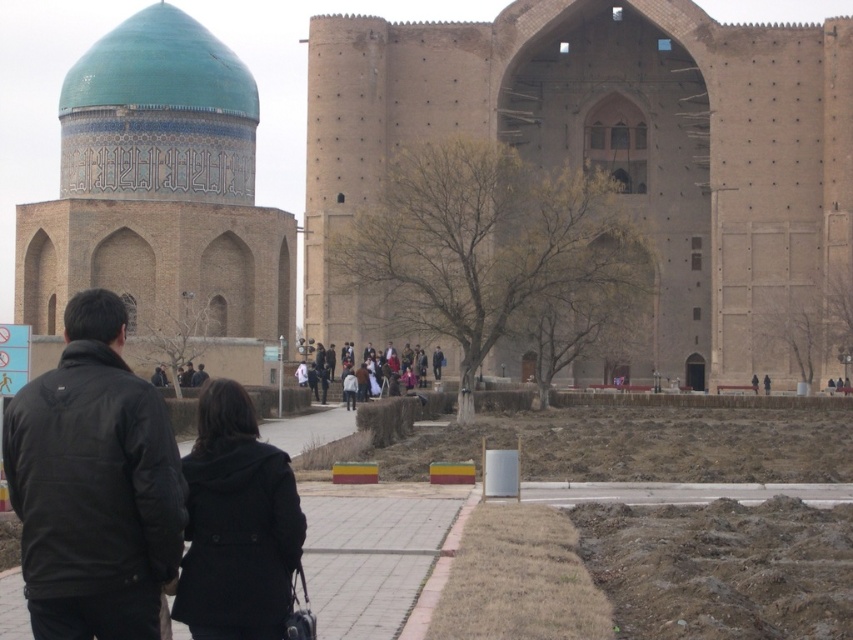
Measure the distance between black softshell jacket at lower left and black wool coat at center.

black softshell jacket at lower left and black wool coat at center are 3.21 meters apart from each other.

You are a GUI agent. You are given a task and a screenshot of the screen. Output one action in this format:
    pyautogui.click(x=<x>, y=<y>)
    Task: Click on the black softshell jacket at lower left
    This screenshot has height=640, width=853.
    Given the screenshot: What is the action you would take?
    pyautogui.click(x=94, y=484)

Does black wool coat at center have a larger size compared to black matte jacket at center?

Yes, black wool coat at center is bigger than black matte jacket at center.

Image resolution: width=853 pixels, height=640 pixels. In order to click on black wool coat at center in this screenshot , I will do `click(236, 524)`.

Does point (286, 456) come in front of point (202, 372)?

Yes.

At what (x,y) coordinates should I click in order to perform the action: click on black wool coat at center. Please return your answer as a coordinate pair (x, y). This screenshot has height=640, width=853. Looking at the image, I should click on (236, 524).

Is black softshell jacket at lower left further to the viewer compared to black matte jacket at center?

No, black softshell jacket at lower left is closer to the viewer.

Can you confirm if black softshell jacket at lower left is smaller than black matte jacket at center?

No.

Which is in front, point (13, 413) or point (198, 376)?

Point (13, 413) is in front.

I want to click on black softshell jacket at lower left, so click(94, 484).